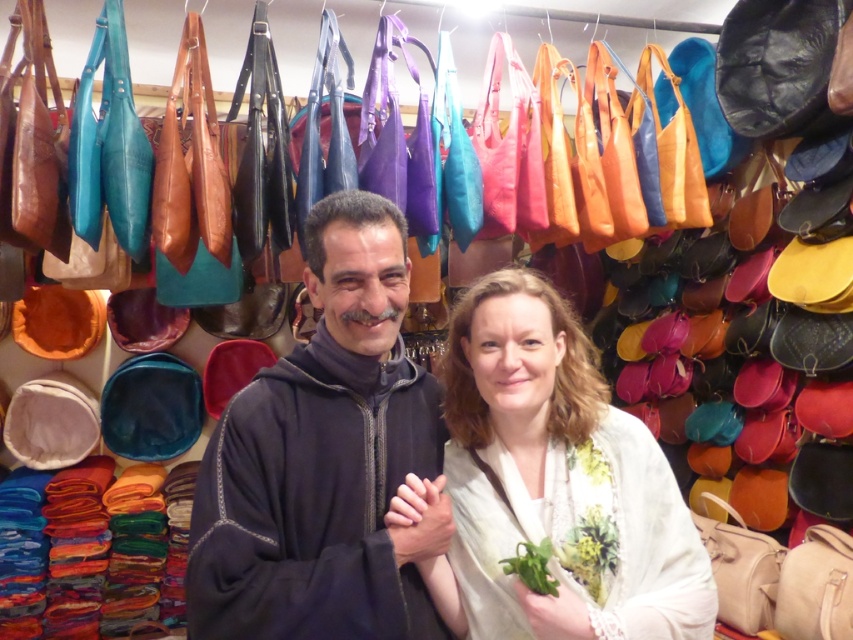
Question: Can you confirm if dark blue fabric at center is bigger than matte white scarf at center?

Choices:
 (A) no
 (B) yes

Answer: (B)

Question: Which point is closer to the camera?

Choices:
 (A) (592, 385)
 (B) (397, 573)

Answer: (B)

Question: Which of the following is the closest to the observer?

Choices:
 (A) matte white scarf at center
 (B) dark blue fabric at center

Answer: (B)

Question: Is dark blue fabric at center above matte white scarf at center?

Choices:
 (A) yes
 (B) no

Answer: (A)

Question: Does dark blue fabric at center come in front of matte white scarf at center?

Choices:
 (A) no
 (B) yes

Answer: (B)